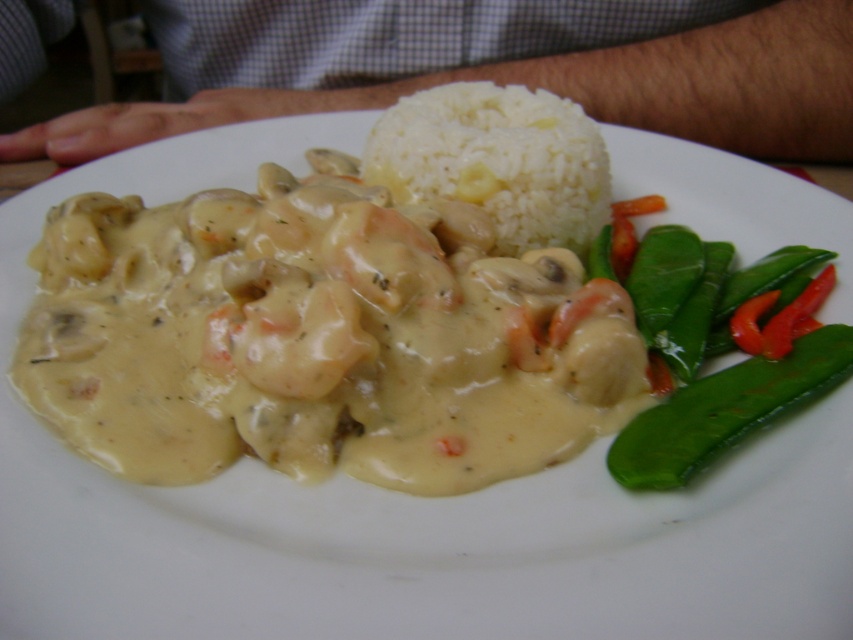
Question: Does white matte rice at center appear on the left side of green smooth bean at lower right?

Choices:
 (A) yes
 (B) no

Answer: (A)

Question: Can you confirm if white matte rice at center is wider than green smooth bean at lower right?

Choices:
 (A) no
 (B) yes

Answer: (B)

Question: Which point is farther to the camera?

Choices:
 (A) (659, 461)
 (B) (508, 177)

Answer: (B)

Question: Can you confirm if white matte rice at center is bigger than green smooth bean at lower right?

Choices:
 (A) no
 (B) yes

Answer: (B)

Question: Which point is farther from the camera taking this photo?

Choices:
 (A) 621,444
 (B) 374,168

Answer: (B)